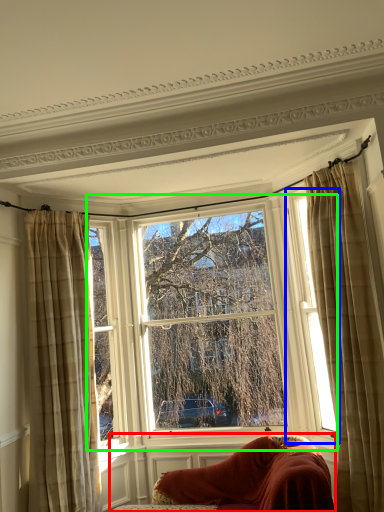
Question: Which object is positioned farthest from furniture (highlighted by a red box)? Select from window (highlighted by a blue box) and window (highlighted by a green box).

Choices:
 (A) window
 (B) window

Answer: (A)